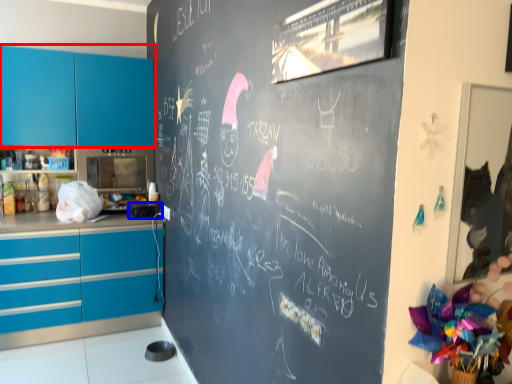
Question: Which of the following is the farthest to the observer, cabinetry (highlighted by a red box) or appliance (highlighted by a blue box)?

Choices:
 (A) cabinetry
 (B) appliance

Answer: (B)